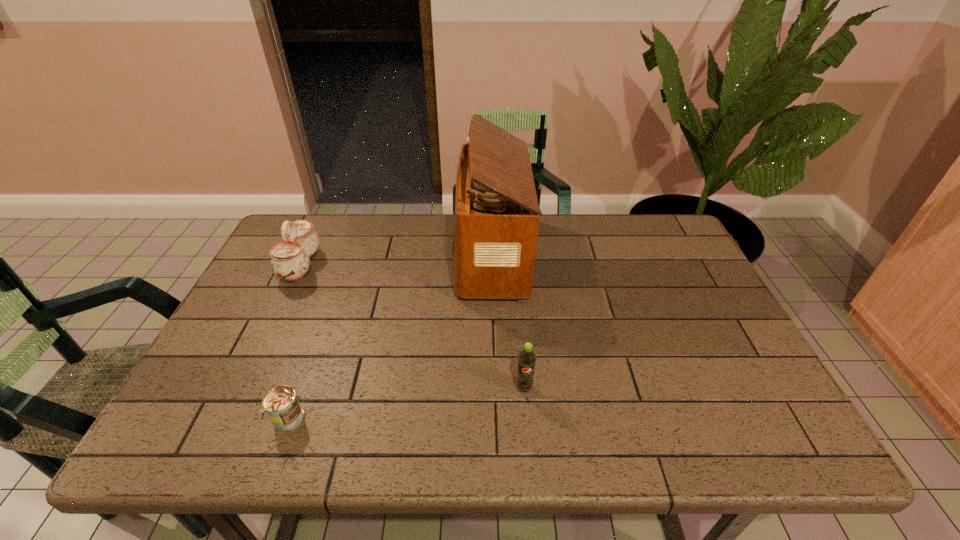
This screenshot has height=540, width=960. In order to click on radio receiver at the far edge in this screenshot , I will do `click(496, 213)`.

I want to click on chinaware positioned at the far edge, so 290,261.

This screenshot has height=540, width=960. I want to click on object positioned at the near edge, so click(281, 403).

You are a GUI agent. You are given a task and a screenshot of the screen. Output one action in this format:
    pyautogui.click(x=<x>, y=<y>)
    Task: Click on the object at the left edge
    This screenshot has width=960, height=540.
    Given the screenshot: What is the action you would take?
    [x=290, y=261]

Image resolution: width=960 pixels, height=540 pixels. What are the coordinates of `object located at the far left corner` in the screenshot? It's located at (290, 261).

Locate an element on the screen. This screenshot has width=960, height=540. free region at the far edge of the desktop is located at coordinates (384, 218).

Find the location of a particular element. This screenshot has width=960, height=540. free space at the left edge of the desktop is located at coordinates (214, 359).

At what (x,y) coordinates should I click in order to perform the action: click on free space at the far left corner of the desktop. Please return your answer as a coordinate pair (x, y). Image resolution: width=960 pixels, height=540 pixels. Looking at the image, I should click on [x=327, y=230].

The height and width of the screenshot is (540, 960). Identify the location of free space at the far right corner of the desktop. (636, 251).

At what (x,y) coordinates should I click in order to perform the action: click on vacant area that lies between the nearest object and the tallest object. Please return your answer as a coordinate pair (x, y). This screenshot has width=960, height=540. Looking at the image, I should click on (389, 338).